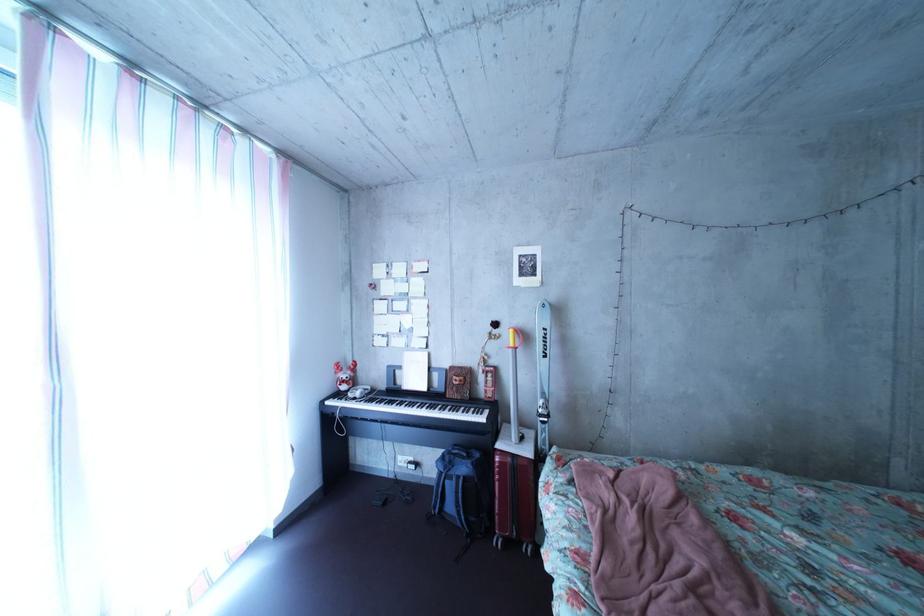
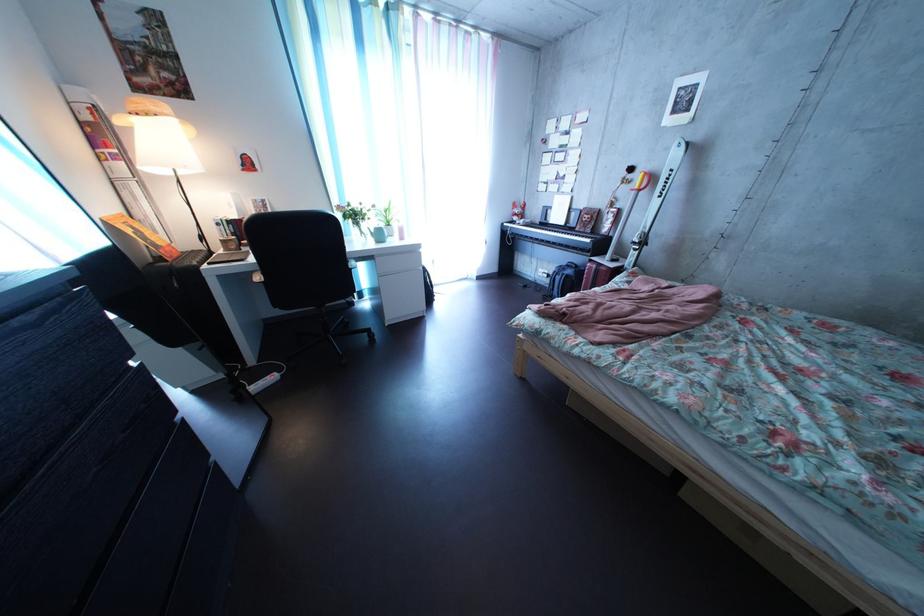
Find the pixel in the second image that matches point (440, 398) in the first image.

(577, 232)